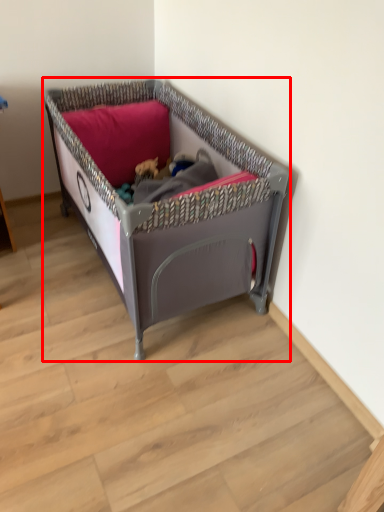
Question: From the image, what is the correct spatial relationship of infant bed (annotated by the red box) in relation to pillow?

Choices:
 (A) left
 (B) right

Answer: (B)